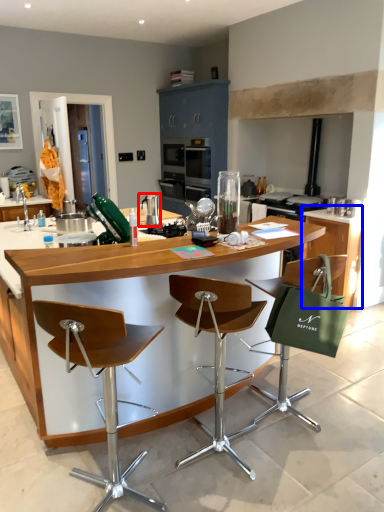
Question: Which object appears farthest to the camera in this image, appliance (highlighted by a red box) or cabinetry (highlighted by a blue box)?

Choices:
 (A) appliance
 (B) cabinetry

Answer: (B)